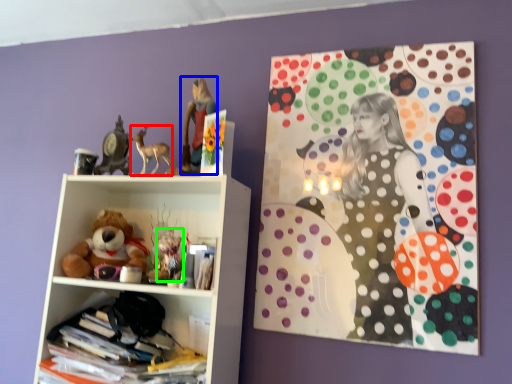
Question: Which is farther away from animal (highlighted by a red box)? girl (highlighted by a blue box) or toy (highlighted by a green box)?

Choices:
 (A) girl
 (B) toy

Answer: (B)